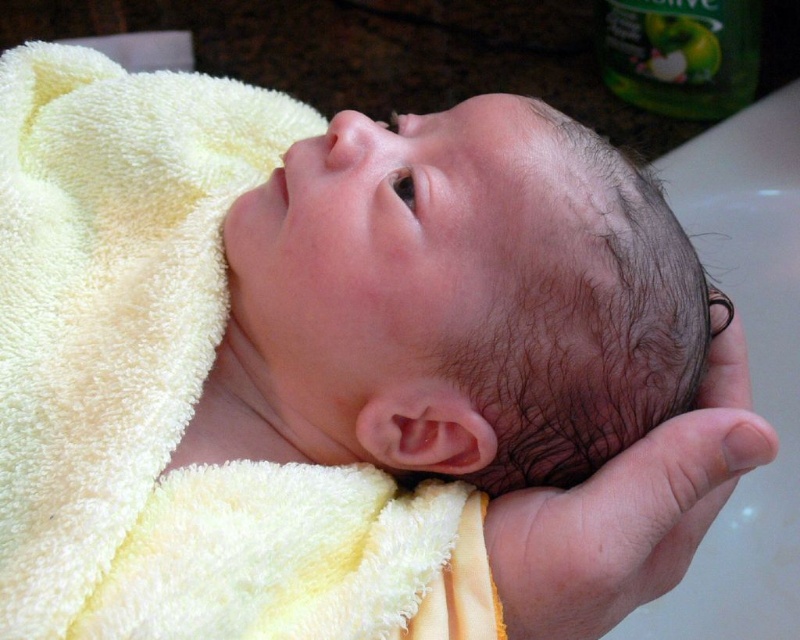
Question: Is smooth skin head at center to the right of smooth skin hand at center from the viewer's perspective?

Choices:
 (A) yes
 (B) no

Answer: (B)

Question: Which of the following is the closest to the observer?

Choices:
 (A) (584, 596)
 (B) (328, 317)

Answer: (A)

Question: Is smooth skin head at center bigger than smooth skin hand at center?

Choices:
 (A) no
 (B) yes

Answer: (B)

Question: Which point appears farthest from the camera in this image?

Choices:
 (A) (650, 515)
 (B) (462, 326)

Answer: (B)

Question: Which point is closer to the camera taking this photo?

Choices:
 (A) [x=270, y=358]
 (B) [x=626, y=586]

Answer: (B)

Question: In this image, where is smooth skin head at center located relative to smooth skin hand at center?

Choices:
 (A) left
 (B) right

Answer: (A)